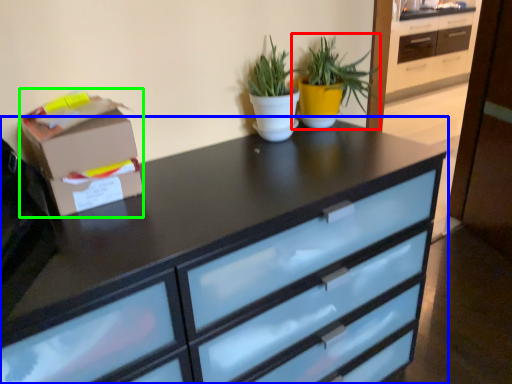
Question: Considering the real-world distances, which object is closest to houseplant (highlighted by a red box)? chest of drawers (highlighted by a blue box) or cardboard box (highlighted by a green box).

Choices:
 (A) chest of drawers
 (B) cardboard box

Answer: (A)